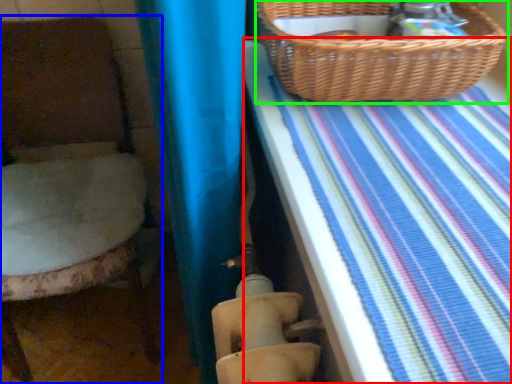
Question: Considering the real-world distances, which object is farthest from sheet (highlighted by a red box)? furniture (highlighted by a blue box) or picnic basket (highlighted by a green box)?

Choices:
 (A) furniture
 (B) picnic basket

Answer: (A)